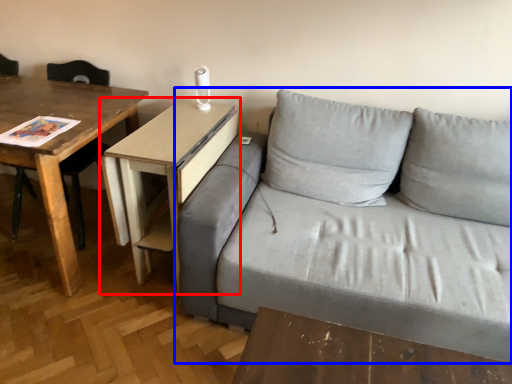
Question: Among these objects, which one is nearest to the camera, table (highlighted by a red box) or studio couch (highlighted by a blue box)?

Choices:
 (A) table
 (B) studio couch

Answer: (B)